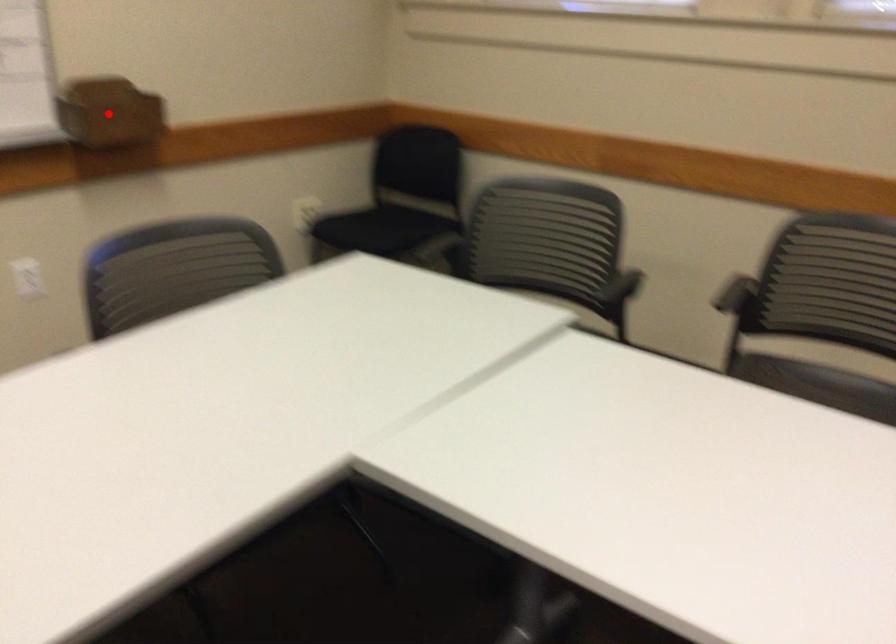
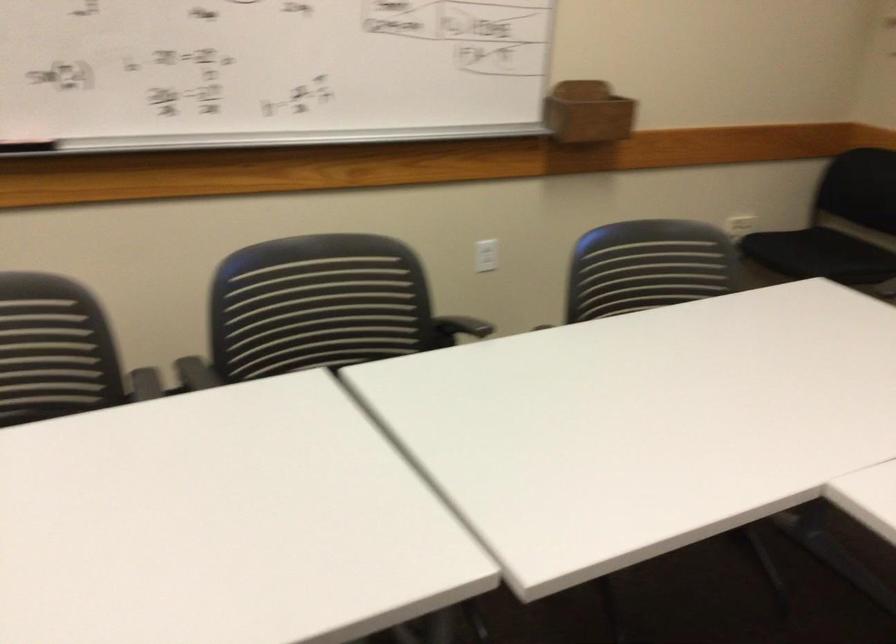
Question: I am providing you with two images of the same scene from different viewpoints. A red point is marked on the first image. Can you still see the location of the red point in image 2?

Choices:
 (A) Yes
 (B) No

Answer: (A)